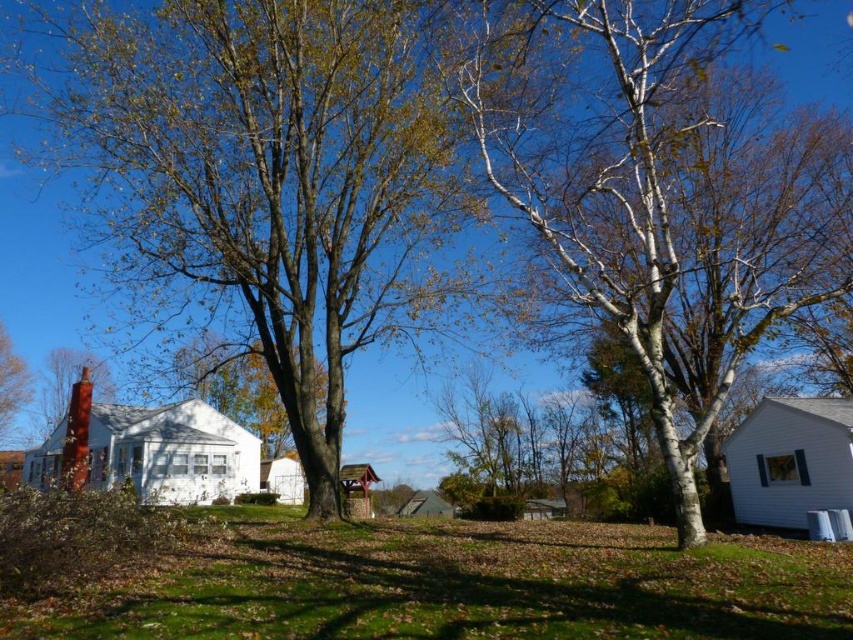
Question: Can you confirm if green grass at center is wider than smooth red chimney at left?

Choices:
 (A) yes
 (B) no

Answer: (A)

Question: Does white smooth birch tree at center lie behind green grass at center?

Choices:
 (A) no
 (B) yes

Answer: (B)

Question: Which object appears closest to the camera in this image?

Choices:
 (A) white smooth birch tree at center
 (B) green grass at center
 (C) white bark birch tree at right

Answer: (B)

Question: Is white bark birch tree at right wider than smooth red chimney at left?

Choices:
 (A) yes
 (B) no

Answer: (A)

Question: Which object is closer to the camera taking this photo?

Choices:
 (A) green grass at center
 (B) smooth red chimney at left
 (C) white bark birch tree at right
 (D) white smooth birch tree at center

Answer: (A)

Question: Which of the following is the farthest from the observer?

Choices:
 (A) smooth red chimney at left
 (B) white bark birch tree at right
 (C) green grass at center
 (D) white smooth birch tree at center

Answer: (A)